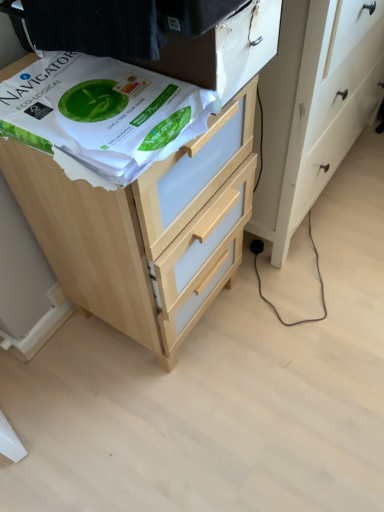
Question: In which direction should I rotate to look at light wood chest of drawers at upper center?

Choices:
 (A) right
 (B) left

Answer: (B)

Question: Can you confirm if light wood chest of drawers at upper center is smaller than white paper at upper left?

Choices:
 (A) no
 (B) yes

Answer: (A)

Question: Is light wood chest of drawers at upper center not near white paper at upper left?

Choices:
 (A) yes
 (B) no

Answer: (B)

Question: Considering the relative positions of light wood chest of drawers at upper center and white paper at upper left in the image provided, is light wood chest of drawers at upper center to the left of white paper at upper left from the viewer's perspective?

Choices:
 (A) no
 (B) yes

Answer: (A)

Question: Does light wood chest of drawers at upper center have a larger size compared to white paper at upper left?

Choices:
 (A) yes
 (B) no

Answer: (A)

Question: From a real-world perspective, is light wood chest of drawers at upper center physically above white paper at upper left?

Choices:
 (A) yes
 (B) no

Answer: (B)

Question: Does light wood chest of drawers at upper center have a greater width compared to white paper at upper left?

Choices:
 (A) yes
 (B) no

Answer: (A)

Question: From the image's perspective, is white paper at upper left under light wood chest of drawers at upper center?

Choices:
 (A) no
 (B) yes

Answer: (A)

Question: Is white paper at upper left completely or partially outside of light wood chest of drawers at upper center?

Choices:
 (A) no
 (B) yes

Answer: (B)

Question: Does white paper at upper left have a lesser height compared to light wood chest of drawers at upper center?

Choices:
 (A) yes
 (B) no

Answer: (A)

Question: Is white paper at upper left positioned before light wood chest of drawers at upper center?

Choices:
 (A) no
 (B) yes

Answer: (B)

Question: Would you say white paper at upper left is a long distance from light wood chest of drawers at upper center?

Choices:
 (A) no
 (B) yes

Answer: (A)

Question: From the image's perspective, would you say white paper at upper left is positioned over light wood chest of drawers at upper center?

Choices:
 (A) no
 (B) yes

Answer: (B)

Question: Is point (94, 108) positioned closer to the camera than point (173, 334)?

Choices:
 (A) farther
 (B) closer

Answer: (B)